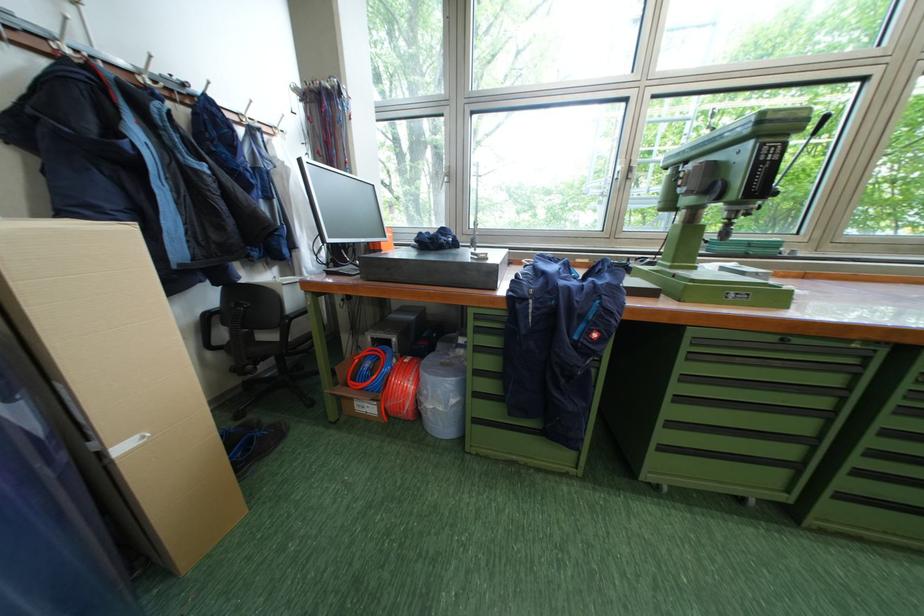
Locate an element on the screen. black chair armrest is located at coordinates (295, 302).